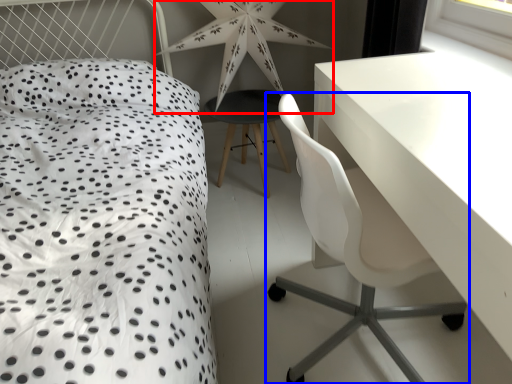
Question: Among these objects, which one is farthest to the camera, star (highlighted by a red box) or chair (highlighted by a blue box)?

Choices:
 (A) star
 (B) chair

Answer: (A)